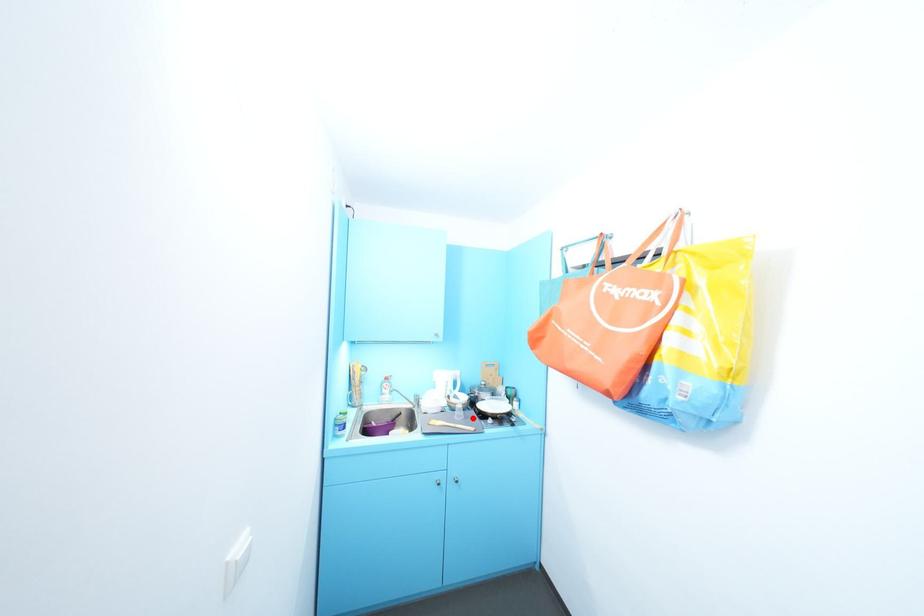
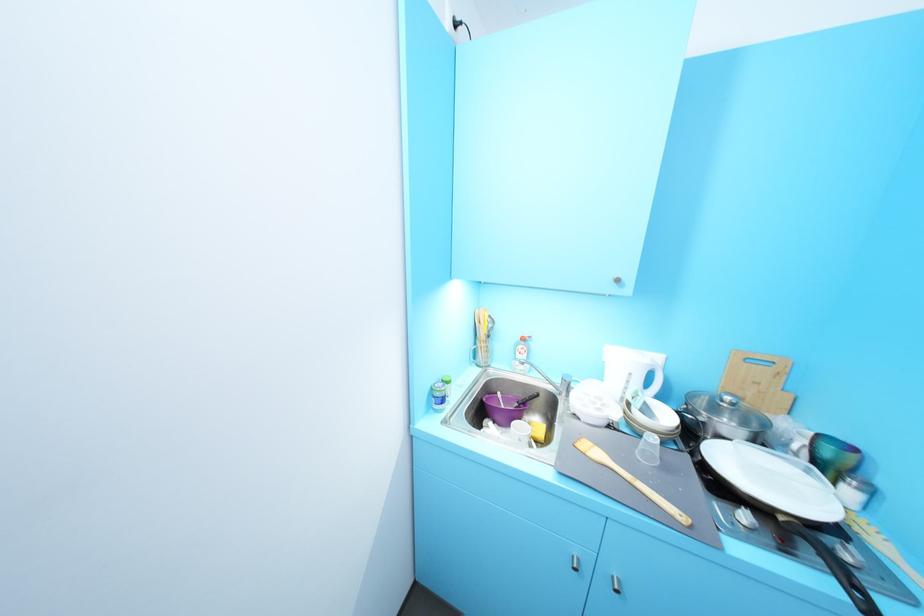
In the second image, find the point that corresponds to the highlighted location in the first image.

(673, 468)